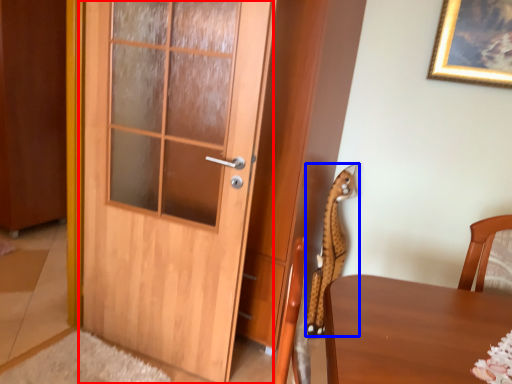
Question: Which of the following is the farthest to the observer, door (highlighted by a red box) or animal (highlighted by a blue box)?

Choices:
 (A) door
 (B) animal

Answer: (B)